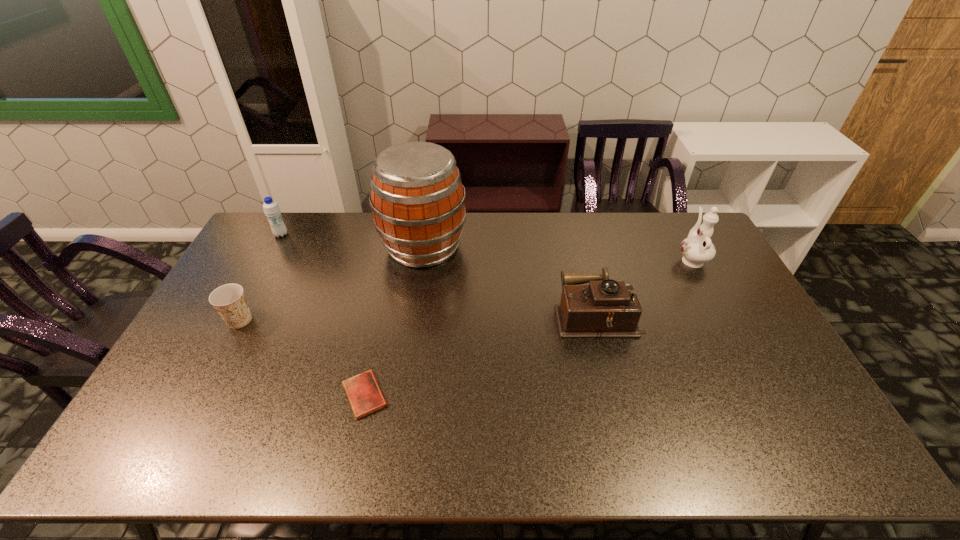
In order to click on the tallest object in this screenshot , I will do `click(417, 198)`.

Image resolution: width=960 pixels, height=540 pixels. What are the coordinates of `the rightmost object` in the screenshot? It's located at (697, 249).

This screenshot has width=960, height=540. Identify the location of chinaware. (697, 249).

Where is `water bottle`? water bottle is located at coordinates (271, 209).

Identify the location of phonograph_record. (605, 308).

Locate an element on the screen. The width and height of the screenshot is (960, 540). Dixie cup is located at coordinates (229, 300).

Find the location of a particular element. The height and width of the screenshot is (540, 960). the nearest object is located at coordinates (364, 394).

This screenshot has width=960, height=540. What are the coordinates of `diary` in the screenshot? It's located at (364, 394).

The height and width of the screenshot is (540, 960). What are the coordinates of `vacant space located 0.060m on the front of the tallest object` in the screenshot? It's located at (418, 288).

Find the location of `blank space located at the spout of the rightmost object`. blank space located at the spout of the rightmost object is located at coordinates (672, 224).